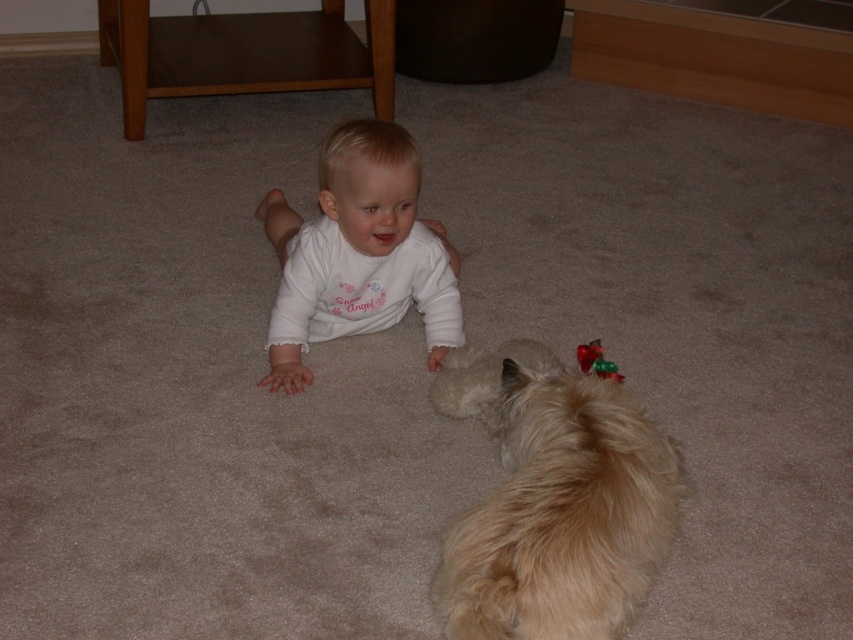
Between point (438, 582) and point (613, 380), which one is positioned in front?

Point (438, 582)

Is fluffy golden fur dog at lower right shorter than shiny red plastic toy at lower right?

No, fluffy golden fur dog at lower right is not shorter than shiny red plastic toy at lower right.

The image size is (853, 640). I want to click on fluffy golden fur dog at lower right, so tap(561, 513).

Is fluffy golden fur dog at lower right taller than white soft baby at center?

In fact, fluffy golden fur dog at lower right may be shorter than white soft baby at center.

Is fluffy golden fur dog at lower right bigger than white soft baby at center?

Incorrect, fluffy golden fur dog at lower right is not larger than white soft baby at center.

What do you see at coordinates (561, 513) in the screenshot? I see `fluffy golden fur dog at lower right` at bounding box center [561, 513].

Image resolution: width=853 pixels, height=640 pixels. What are the coordinates of `fluffy golden fur dog at lower right` in the screenshot? It's located at click(x=561, y=513).

Which is behind, point (287, 392) or point (578, 355)?

Positioned behind is point (287, 392).

Between white soft baby at center and shiny red plastic toy at lower right, which one is positioned higher?

Positioned higher is white soft baby at center.

Find the location of a particular element. white soft baby at center is located at coordinates (358, 252).